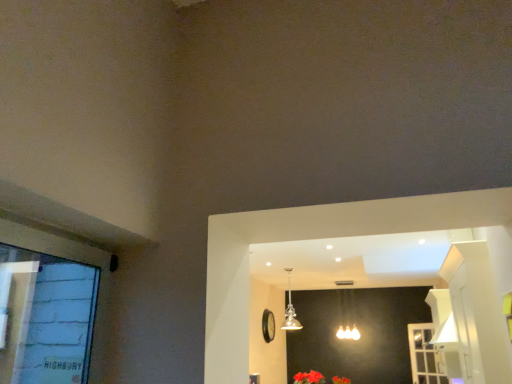
Question: In which direction should I rotate to look at matte silver lamp at center, which is the 2th lamp from left to right?

Choices:
 (A) left
 (B) right

Answer: (B)

Question: Is matte silver lamp at center, arranged as the 2th lamp when viewed from the front, bigger than white plastic screen door at lower right?

Choices:
 (A) yes
 (B) no

Answer: (A)

Question: Does matte silver lamp at center, the first lamp when ordered from right to left, have a lesser width compared to white plastic screen door at lower right?

Choices:
 (A) yes
 (B) no

Answer: (B)

Question: From a real-world perspective, does matte silver lamp at center, arranged as the 2th lamp when viewed from the front, sit lower than white plastic screen door at lower right?

Choices:
 (A) no
 (B) yes

Answer: (A)

Question: Does matte silver lamp at center, which is the 1th lamp from back to front, contain white plastic screen door at lower right?

Choices:
 (A) yes
 (B) no

Answer: (B)

Question: Considering the relative positions of matte silver lamp at center, arranged as the 2th lamp when viewed from the front, and white plastic screen door at lower right in the image provided, is matte silver lamp at center, arranged as the 2th lamp when viewed from the front, to the left of white plastic screen door at lower right from the viewer's perspective?

Choices:
 (A) yes
 (B) no

Answer: (A)

Question: Does matte silver lamp at center, arranged as the 2th lamp when viewed from the front, come in front of white plastic screen door at lower right?

Choices:
 (A) no
 (B) yes

Answer: (A)

Question: From the image's perspective, is matte silver lamp at center, which is the 1th lamp from back to front, under vivid red petals at lower center, which appears as the 2th flower when ordered from the bottom?

Choices:
 (A) no
 (B) yes

Answer: (A)

Question: Does matte silver lamp at center, which is the 1th lamp from back to front, lie behind vivid red petals at lower center, which appears as the 2th flower when ordered from the bottom?

Choices:
 (A) yes
 (B) no

Answer: (A)

Question: Can you confirm if matte silver lamp at center, which is the 2th lamp from left to right, is bigger than vivid red petals at lower center, the 2th flower from the back?

Choices:
 (A) yes
 (B) no

Answer: (A)

Question: Does matte silver lamp at center, which is the 1th lamp from back to front, have a greater height compared to vivid red petals at lower center, marked as the first flower in a top-to-bottom arrangement?

Choices:
 (A) yes
 (B) no

Answer: (A)

Question: From a real-world perspective, is matte silver lamp at center, the first lamp when ordered from right to left, physically above vivid red petals at lower center, which is the second flower from right to left?

Choices:
 (A) yes
 (B) no

Answer: (A)

Question: Could you tell me if matte silver lamp at center, which is the 2th lamp from left to right, is turned towards vivid red petals at lower center, marked as the 1th flower in a left-to-right arrangement?

Choices:
 (A) no
 (B) yes

Answer: (B)

Question: Does white plastic screen door at lower right appear on the left side of matte silver lamp at center, the first lamp when ordered from right to left?

Choices:
 (A) yes
 (B) no

Answer: (B)